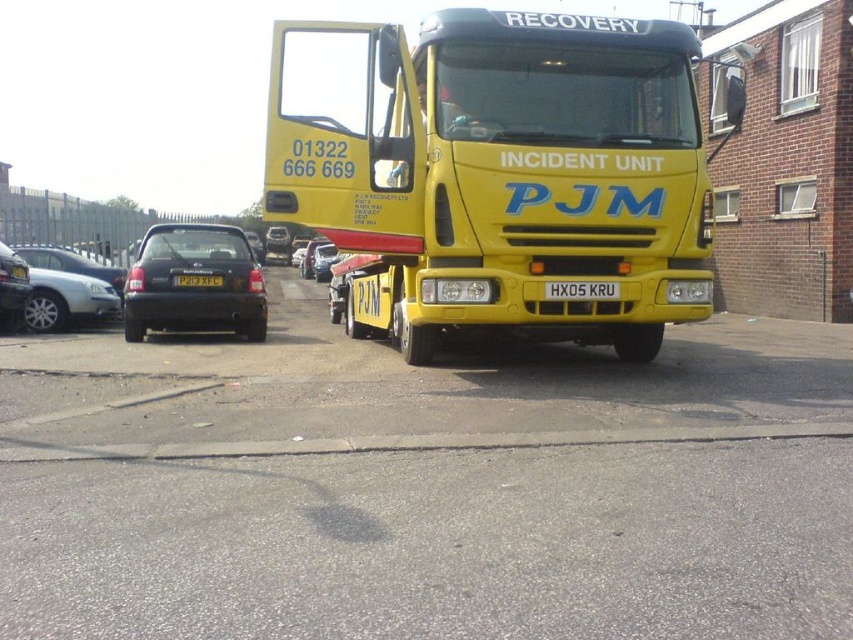
You are a driver who needs to park your car next to the black metallic car at left and the yellow matte license plate at center. Which object requires more space in width for parking?

The black metallic car at left requires more space in width for parking because its width is larger than the yellow matte license plate at center.